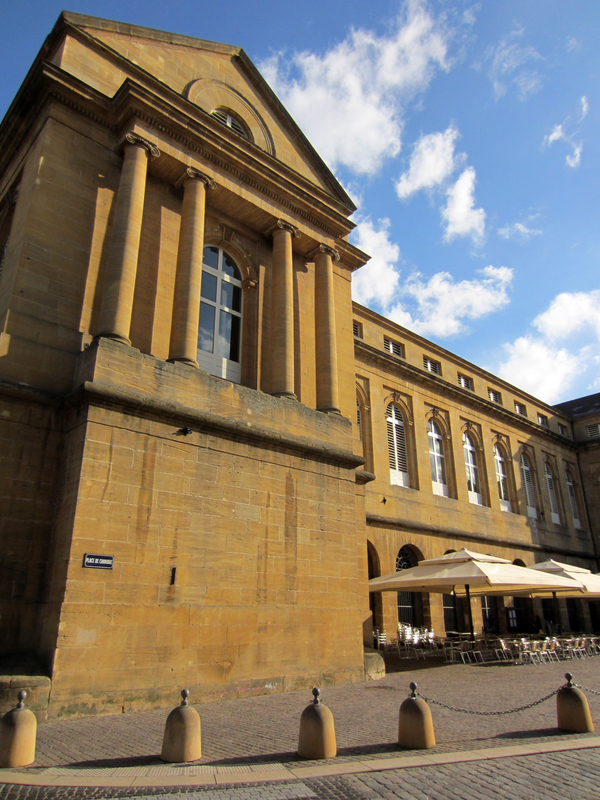
The image size is (600, 800). Identify the location of chair. pyautogui.click(x=385, y=641).